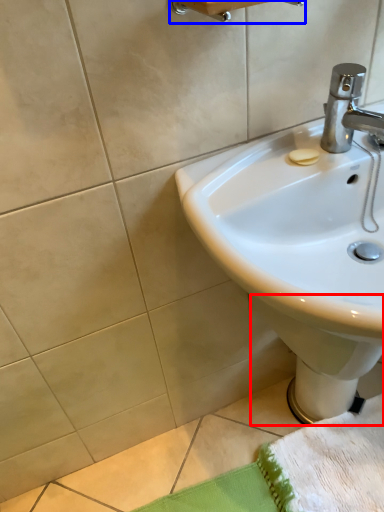
Question: Which of the following is the farthest to the observer, bidet (highlighted by a red box) or towel bar (highlighted by a blue box)?

Choices:
 (A) bidet
 (B) towel bar

Answer: (A)